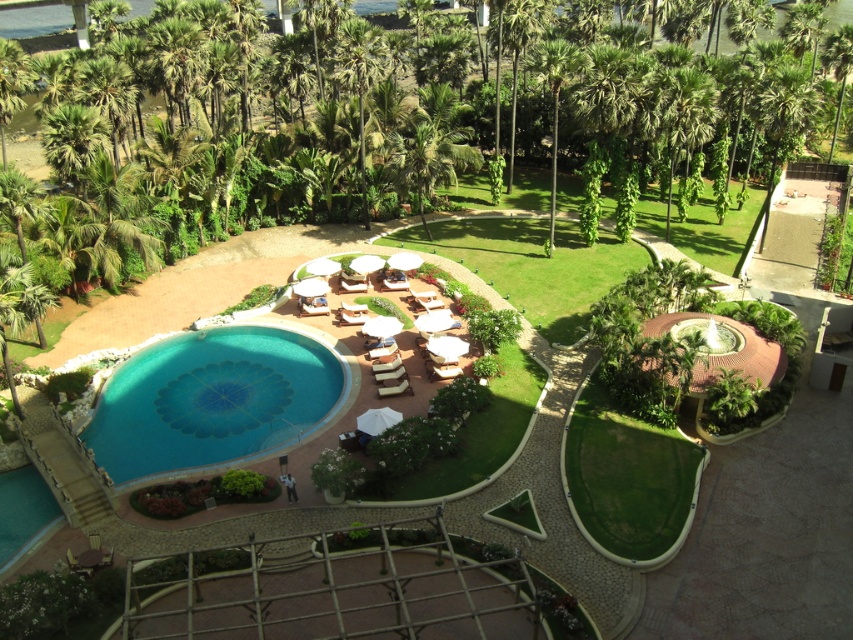
Question: Which point appears farthest from the camera in this image?

Choices:
 (A) (573, 68)
 (B) (109, 378)

Answer: (A)

Question: Among these objects, which one is nearest to the camera?

Choices:
 (A) teal glossy pool at center
 (B) green leafy palm tree at upper center

Answer: (A)

Question: Does teal glossy pool at center appear on the left side of green leafy palm tree at center?

Choices:
 (A) yes
 (B) no

Answer: (A)

Question: Is teal glossy pool at center to the left of green leafy palm tree at upper center from the viewer's perspective?

Choices:
 (A) yes
 (B) no

Answer: (A)

Question: Is teal glossy pool at center smaller than green leafy palm tree at upper center?

Choices:
 (A) no
 (B) yes

Answer: (B)

Question: Which object is closer to the camera taking this photo?

Choices:
 (A) green leafy palm tree at upper center
 (B) green leafy palm tree at center

Answer: (B)